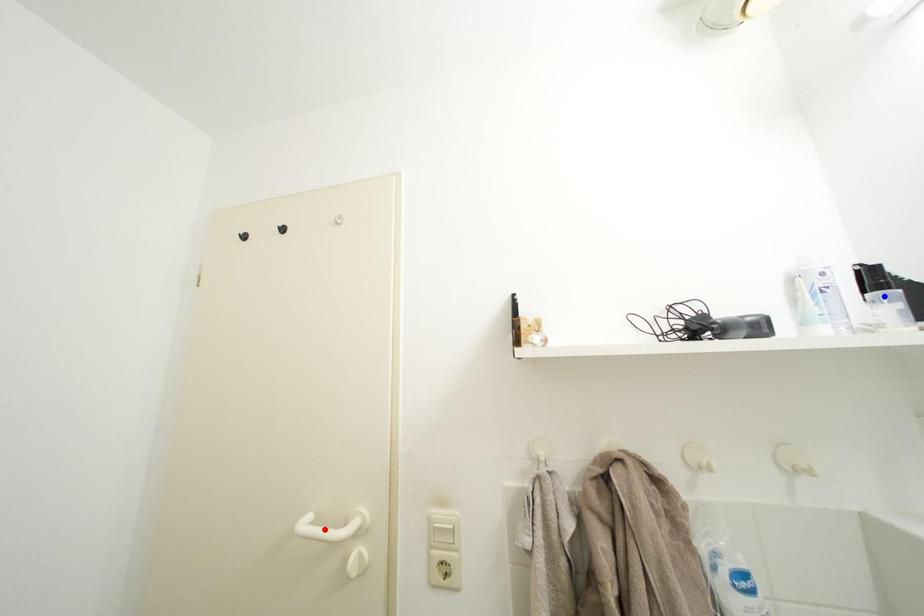
Question: Two points are marked on the image. Which point is closer to the camera?

Choices:
 (A) Blue point is closer.
 (B) Red point is closer.

Answer: (A)